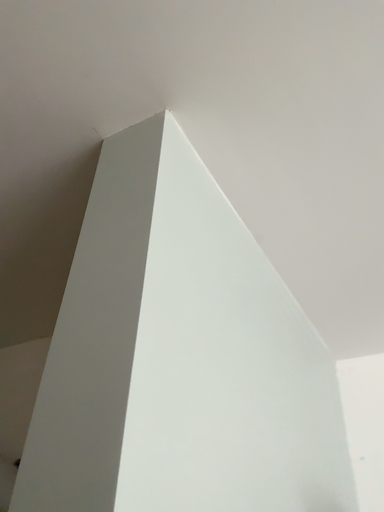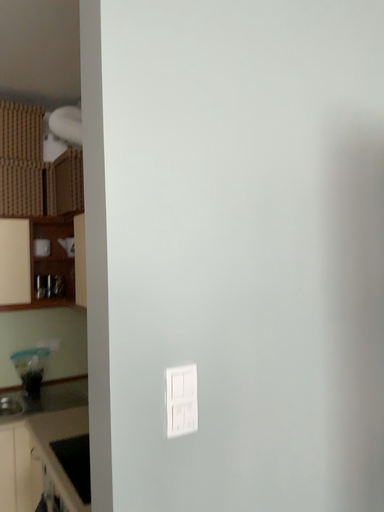
Question: How did the camera likely rotate when shooting the video?

Choices:
 (A) rotated left
 (B) rotated right

Answer: (A)